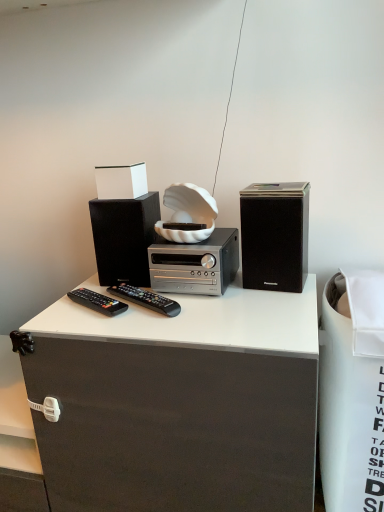
Identify the location of black plastic remote at center, which is the 2th remote control in left-to-right order. (146, 298).

In order to face white matte box at upper center, should I rotate leftwards or rightwards?

A 9.427 degree turn to the left will do.

What do you see at coordinates (121, 181) in the screenshot? I see `white matte box at upper center` at bounding box center [121, 181].

What is the approximate height of white fabric trash bin at right?

white fabric trash bin at right is 27.52 inches tall.

Locate an element on the screen. black plastic remote at center, which is the 2th remote control in left-to-right order is located at coordinates (146, 298).

Based on the photo, is black matte speaker at right, which is the second loudspeaker in left-to-right order, smaller than white fabric trash bin at right?

Yes.

I want to click on the 2nd loudspeaker above the white fabric trash bin at right (from a real-world perspective), so click(275, 236).

From a real-world perspective, is black matte speaker at right, which is counted as the first loudspeaker, starting from the right, below white fabric trash bin at right?

No, from a real-world perspective, black matte speaker at right, which is counted as the first loudspeaker, starting from the right, is not under white fabric trash bin at right.

In terms of width, does black matte speaker at right, which is counted as the first loudspeaker, starting from the right, look wider or thinner when compared to white fabric trash bin at right?

Considering their sizes, black matte speaker at right, which is counted as the first loudspeaker, starting from the right, looks slimmer than white fabric trash bin at right.

Is black plastic remote at center, the 1th remote control in the right-to-left sequence, behind black plastic remote control at lower left, acting as the 2th remote control starting from the right?

No, black plastic remote at center, the 1th remote control in the right-to-left sequence, is closer to the camera.

Locate an element on the screen. This screenshot has height=512, width=384. remote control behind the black plastic remote at center, the 1th remote control in the right-to-left sequence is located at coordinates (97, 302).

Could you measure the distance between black plastic remote at center, the 1th remote control in the right-to-left sequence, and black plastic remote control at lower left, acting as the 2th remote control starting from the right?

black plastic remote at center, the 1th remote control in the right-to-left sequence, and black plastic remote control at lower left, acting as the 2th remote control starting from the right, are 2.25 inches apart from each other.

Is black plastic remote at center, the 1th remote control in the right-to-left sequence, bigger or smaller than black plastic remote control at lower left, acting as the 2th remote control starting from the right?

Considering their sizes, black plastic remote at center, the 1th remote control in the right-to-left sequence, takes up more space than black plastic remote control at lower left, acting as the 2th remote control starting from the right.

Which object is positioned more to the right, black matte speaker at right, which is the second loudspeaker in left-to-right order, or black matte speaker at left, the 2th loudspeaker positioned from the right?

From the viewer's perspective, black matte speaker at right, which is the second loudspeaker in left-to-right order, appears more on the right side.

Is black matte speaker at right, which is counted as the first loudspeaker, starting from the right, turned away from black matte speaker at left, which is counted as the first loudspeaker, starting from the left?

No, black matte speaker at right, which is counted as the first loudspeaker, starting from the right, is not facing the opposite direction of black matte speaker at left, which is counted as the first loudspeaker, starting from the left.

Between black matte speaker at right, which is counted as the first loudspeaker, starting from the right, and black matte speaker at left, which is counted as the first loudspeaker, starting from the left, which one has more height?

With more height is black matte speaker at right, which is counted as the first loudspeaker, starting from the right.

Is black matte speaker at right, which is the second loudspeaker in left-to-right order, positioned far away from black matte speaker at left, which is counted as the first loudspeaker, starting from the left?

No, black matte speaker at right, which is the second loudspeaker in left-to-right order, is in close proximity to black matte speaker at left, which is counted as the first loudspeaker, starting from the left.

Is point (296, 197) behind point (122, 306)?

No, it is not.

Visually, is black matte speaker at right, which is counted as the first loudspeaker, starting from the right, positioned to the left or to the right of black plastic remote control at lower left, placed as the first remote control when sorted from left to right?

Clearly, black matte speaker at right, which is counted as the first loudspeaker, starting from the right, is on the right of black plastic remote control at lower left, placed as the first remote control when sorted from left to right, in the image.

Locate an element on the screen. the 2nd loudspeaker directly above the black plastic remote control at lower left, placed as the first remote control when sorted from left to right (from a real-world perspective) is located at coordinates (275, 236).

Is black plastic remote control at lower left, placed as the first remote control when sorted from left to right, a part of black matte speaker at right, which is counted as the first loudspeaker, starting from the right?

No, black plastic remote control at lower left, placed as the first remote control when sorted from left to right, is not a part of black matte speaker at right, which is counted as the first loudspeaker, starting from the right.

Is the position of black plastic remote control at lower left, placed as the first remote control when sorted from left to right, more distant than that of black plastic remote at center, the 1th remote control in the right-to-left sequence?

Yes, black plastic remote control at lower left, placed as the first remote control when sorted from left to right, is further from the viewer.

From a real-world perspective, which object stands above the other?

black plastic remote at center, the 1th remote control in the right-to-left sequence, is physically above.

Between black plastic remote control at lower left, acting as the 2th remote control starting from the right, and black plastic remote at center, the 1th remote control in the right-to-left sequence, which one has more height?

With more height is black plastic remote at center, the 1th remote control in the right-to-left sequence.

How many degrees apart are the facing directions of black plastic remote at center, which is the 2th remote control in left-to-right order, and white matte box at upper center?

black plastic remote at center, which is the 2th remote control in left-to-right order, and white matte box at upper center are facing 31.2 degrees away from each other.

Would you say black plastic remote at center, which is the 2th remote control in left-to-right order, contains white matte box at upper center?

Actually, white matte box at upper center is outside black plastic remote at center, which is the 2th remote control in left-to-right order.

There is a white matte box at upper center. What are the coordinates of `the 1st remote control below it (from a real-world perspective)` in the screenshot? It's located at (146, 298).

Based on the photo, can you confirm if silver metallic stereo at center is wider than black matte speaker at right, which is the second loudspeaker in left-to-right order?

Yes.

Is point (187, 272) behind point (251, 288)?

No.

Is silver metallic stereo at center to the left of black matte speaker at right, which is the second loudspeaker in left-to-right order, from the viewer's perspective?

Yes.

Is silver metallic stereo at center positioned with its back to black matte speaker at right, which is counted as the first loudspeaker, starting from the right?

No, silver metallic stereo at center is not facing the opposite direction of black matte speaker at right, which is counted as the first loudspeaker, starting from the right.

The width and height of the screenshot is (384, 512). I want to click on trash bin/can located in front of the black matte speaker at right, which is the second loudspeaker in left-to-right order, so click(x=352, y=393).

Image resolution: width=384 pixels, height=512 pixels. In order to click on remote control above the black plastic remote control at lower left, acting as the 2th remote control starting from the right (from the image's perspective) in this screenshot , I will do `click(146, 298)`.

When comparing their distances from black matte speaker at left, which is counted as the first loudspeaker, starting from the left, does black matte speaker at right, which is counted as the first loudspeaker, starting from the right, or white matte box at upper center seem further?

Among the two, black matte speaker at right, which is counted as the first loudspeaker, starting from the right, is located further to black matte speaker at left, which is counted as the first loudspeaker, starting from the left.

Based on their spatial positions, is black matte speaker at left, the 2th loudspeaker positioned from the right, or white matte box at upper center closer to black plastic remote at center, which is the 2th remote control in left-to-right order?

black matte speaker at left, the 2th loudspeaker positioned from the right, is positioned closer to the anchor black plastic remote at center, which is the 2th remote control in left-to-right order.

Which object lies nearer to the anchor point silver metallic stereo at center, black plastic remote at center, which is the 2th remote control in left-to-right order, or black plastic remote control at lower left, placed as the first remote control when sorted from left to right?

Among the two, black plastic remote at center, which is the 2th remote control in left-to-right order, is located nearer to silver metallic stereo at center.

Which object lies nearer to the anchor point black matte speaker at left, which is counted as the first loudspeaker, starting from the left, white fabric trash bin at right or black plastic remote at center, the 1th remote control in the right-to-left sequence?

black plastic remote at center, the 1th remote control in the right-to-left sequence, is closer to black matte speaker at left, which is counted as the first loudspeaker, starting from the left.

Consider the image. Based on their spatial positions, is black matte speaker at left, which is counted as the first loudspeaker, starting from the left, or black matte speaker at right, which is counted as the first loudspeaker, starting from the right, further from black plastic remote control at lower left, placed as the first remote control when sorted from left to right?

black matte speaker at right, which is counted as the first loudspeaker, starting from the right, is positioned further to the anchor black plastic remote control at lower left, placed as the first remote control when sorted from left to right.

Based on their spatial positions, is black matte speaker at right, which is counted as the first loudspeaker, starting from the right, or black plastic remote control at lower left, acting as the 2th remote control starting from the right, closer to silver metallic stereo at center?

The object closer to silver metallic stereo at center is black matte speaker at right, which is counted as the first loudspeaker, starting from the right.

Which object lies nearer to the anchor point white matte box at upper center, black plastic remote at center, which is the 2th remote control in left-to-right order, or black matte speaker at right, which is counted as the first loudspeaker, starting from the right?

Based on the image, black plastic remote at center, which is the 2th remote control in left-to-right order, appears to be nearer to white matte box at upper center.

In the scene shown: From the image, which object appears to be farther from black plastic remote control at lower left, placed as the first remote control when sorted from left to right, black plastic remote at center, the 1th remote control in the right-to-left sequence, or white fabric trash bin at right?

Among the two, white fabric trash bin at right is located further to black plastic remote control at lower left, placed as the first remote control when sorted from left to right.

Find the location of `appliance situated between black plastic remote control at lower left, acting as the 2th remote control starting from the right, and black matte speaker at right, which is counted as the first loudspeaker, starting from the right, from left to right`. appliance situated between black plastic remote control at lower left, acting as the 2th remote control starting from the right, and black matte speaker at right, which is counted as the first loudspeaker, starting from the right, from left to right is located at coordinates (195, 264).

The width and height of the screenshot is (384, 512). Identify the location of remote control that lies between white matte box at upper center and black plastic remote control at lower left, placed as the first remote control when sorted from left to right, from top to bottom. point(146,298).

This screenshot has width=384, height=512. What are the coordinates of `box situated between black plastic remote control at lower left, placed as the first remote control when sorted from left to right, and white fabric trash bin at right from left to right` in the screenshot? It's located at (121, 181).

This screenshot has width=384, height=512. In order to click on loudspeaker between black plastic remote control at lower left, acting as the 2th remote control starting from the right, and black matte speaker at right, which is counted as the first loudspeaker, starting from the right in this screenshot , I will do `click(124, 238)`.